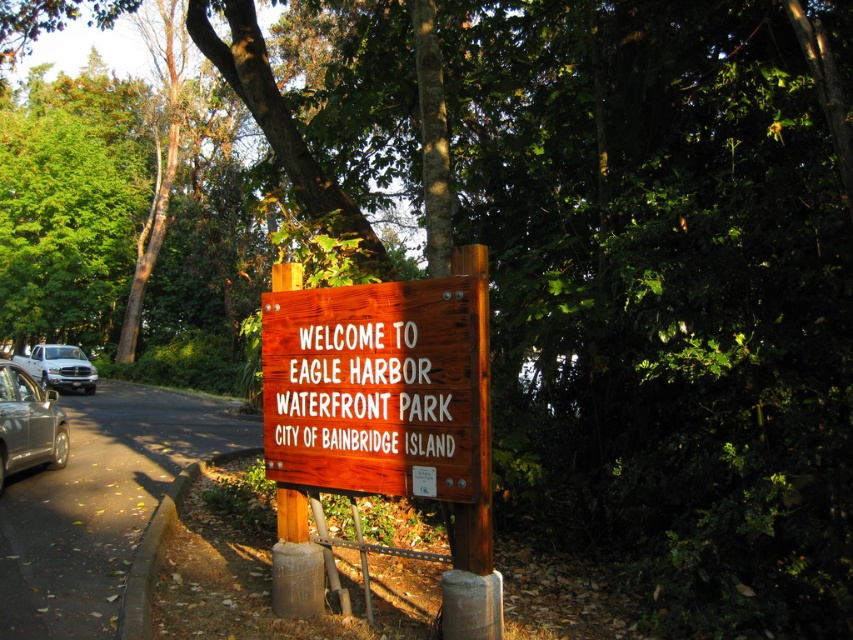
Find the location of a particular element. The image size is (853, 640). silver metallic car at left is located at coordinates (28, 424).

The height and width of the screenshot is (640, 853). Describe the element at coordinates (28, 424) in the screenshot. I see `silver metallic car at left` at that location.

Between point (26, 451) and point (32, 372), which one is positioned behind?

Positioned behind is point (32, 372).

The width and height of the screenshot is (853, 640). Find the location of `silver metallic car at left`. silver metallic car at left is located at coordinates pos(28,424).

Can you confirm if wooden sign at center is positioned to the right of silver metallic car at left?

Yes, wooden sign at center is to the right of silver metallic car at left.

Can you confirm if wooden sign at center is positioned above silver metallic car at left?

Correct, wooden sign at center is located above silver metallic car at left.

Where is `wooden sign at center`? wooden sign at center is located at coordinates (374, 387).

Does wooden sign at center have a greater width compared to white matte truck at left?

Incorrect, wooden sign at center's width does not surpass white matte truck at left's.

Is wooden sign at center taller than white matte truck at left?

No.

Image resolution: width=853 pixels, height=640 pixels. Describe the element at coordinates (374, 387) in the screenshot. I see `wooden sign at center` at that location.

At what (x,y) coordinates should I click in order to perform the action: click on wooden sign at center. Please return your answer as a coordinate pair (x, y). Image resolution: width=853 pixels, height=640 pixels. Looking at the image, I should click on (374, 387).